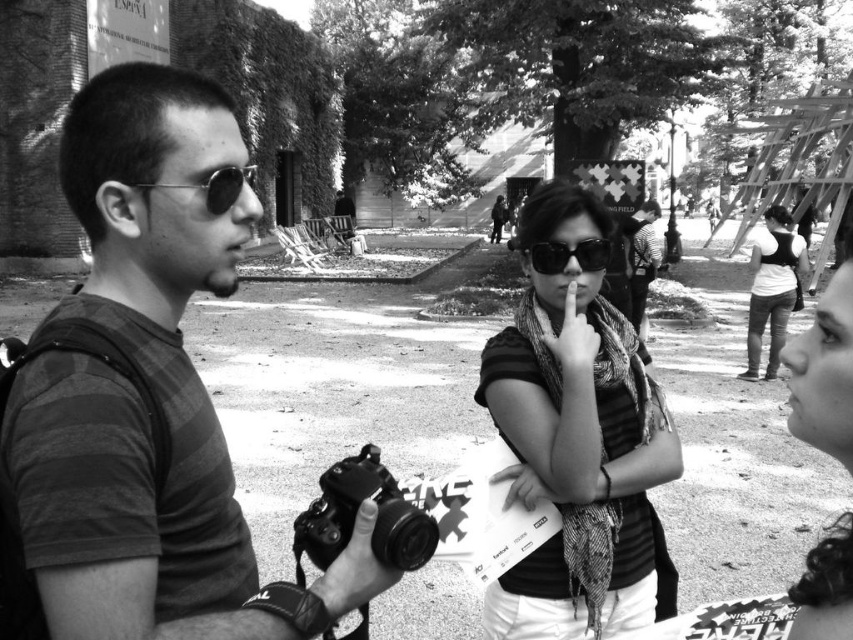
Question: Is striped fabric scarf at center above metallic round sunglasses at left?

Choices:
 (A) yes
 (B) no

Answer: (B)

Question: Which object is positioned farthest from the matte black camera at center?

Choices:
 (A) metallic round sunglasses at left
 (B) matte black camera at left
 (C) striped fabric scarf at center
 (D) white matte shirt at right

Answer: (D)

Question: Is matte black camera at left thinner than striped fabric scarf at center?

Choices:
 (A) no
 (B) yes

Answer: (A)

Question: Which object appears closest to the camera in this image?

Choices:
 (A) metallic round sunglasses at left
 (B) matte black camera at center
 (C) matte black sunglasses at center

Answer: (B)

Question: Does striped fabric scarf at center appear on the right side of matte black camera at center?

Choices:
 (A) no
 (B) yes

Answer: (B)

Question: Among these objects, which one is farthest from the camera?

Choices:
 (A) striped fabric scarf at center
 (B) matte black camera at left

Answer: (A)